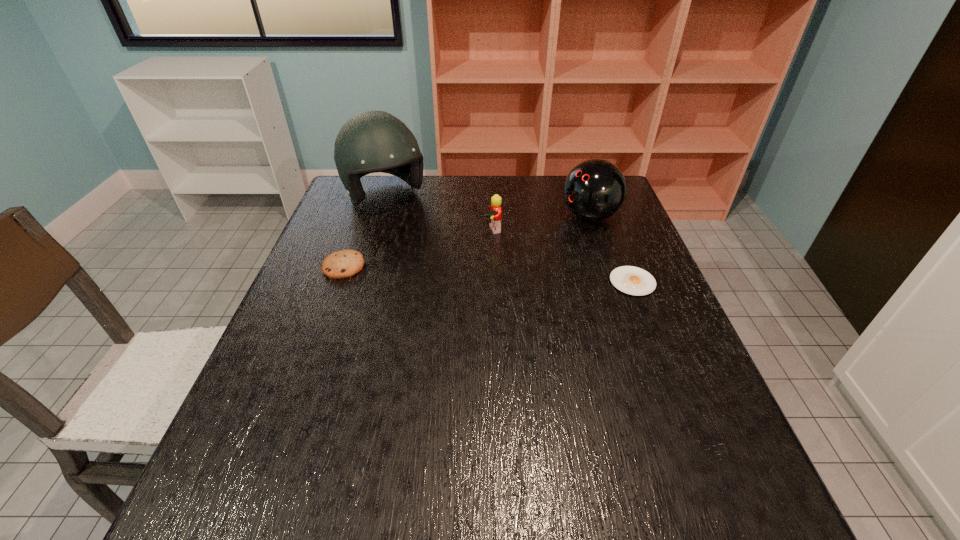
Image resolution: width=960 pixels, height=540 pixels. What are the coordinates of `football helmet that is at the left edge` in the screenshot? It's located at (372, 141).

The height and width of the screenshot is (540, 960). In order to click on egg yolk located at the right edge in this screenshot , I will do `click(631, 280)`.

This screenshot has width=960, height=540. Find the location of `bowling ball that is at the right edge`. bowling ball that is at the right edge is located at coordinates (595, 189).

Locate an element on the screen. object that is at the far left corner is located at coordinates (372, 141).

The image size is (960, 540). In order to click on object positioned at the far right corner in this screenshot , I will do `click(595, 189)`.

Identify the location of vacant space at the far edge of the desktop. The height and width of the screenshot is (540, 960). 422,198.

In the image, there is a desktop. Find the location of `vacant area at the near edge`. vacant area at the near edge is located at coordinates (445, 440).

This screenshot has height=540, width=960. What are the coordinates of `vacant space at the left edge of the desktop` in the screenshot? It's located at (366, 256).

Find the location of a particular element. The image size is (960, 540). vacant region at the right edge of the desktop is located at coordinates (640, 317).

Where is `vacant point located between the tallest object and the cookie`? Image resolution: width=960 pixels, height=540 pixels. vacant point located between the tallest object and the cookie is located at coordinates (365, 232).